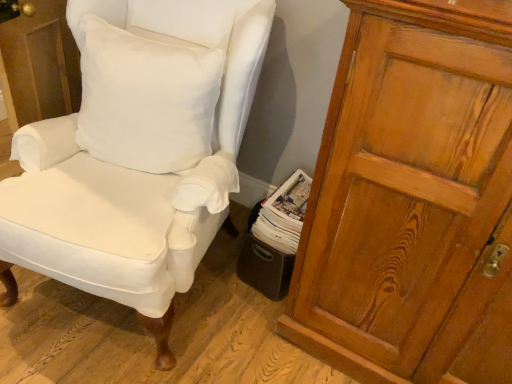
What is the approximate height of white fabric chair at center?

It is 1.01 meters.

Measure the distance between point (x=143, y=56) and camera.

They are 1.31 meters apart.

Image resolution: width=512 pixels, height=384 pixels. Describe the element at coordinates (146, 98) in the screenshot. I see `white cotton pillow at upper left` at that location.

Where is `white fabric chair at center`? Image resolution: width=512 pixels, height=384 pixels. white fabric chair at center is located at coordinates (137, 153).

Is white fabric chair at center facing towards wooden cupboard at right?

No.

Is white fabric chair at center to the left of wooden cupboard at right from the viewer's perspective?

Correct, you'll find white fabric chair at center to the left of wooden cupboard at right.

Which of these two, white fabric chair at center or wooden cupboard at right, is thinner?

With smaller width is wooden cupboard at right.

From a real-world perspective, is white fabric chair at center over wooden cupboard at right?

No, from a real-world perspective, white fabric chair at center is not above wooden cupboard at right.

Is white cotton pillow at upper left in contact with white fabric chair at center?

white cotton pillow at upper left and white fabric chair at center are not in contact.

Could you tell me if white cotton pillow at upper left is facing white fabric chair at center?

Yes, white cotton pillow at upper left faces towards white fabric chair at center.

From a real-world perspective, who is located higher, white cotton pillow at upper left or white fabric chair at center?

In real-world perspective, white cotton pillow at upper left is above.

From the image's perspective, does white cotton pillow at upper left appear higher than white fabric chair at center?

Correct, white cotton pillow at upper left appears higher than white fabric chair at center in the image.

In terms of width, does wooden cupboard at right look wider or thinner when compared to white fabric chair at center?

Clearly, wooden cupboard at right has less width compared to white fabric chair at center.

Is wooden cupboard at right inside the boundaries of white fabric chair at center, or outside?

wooden cupboard at right is not enclosed by white fabric chair at center.

Between wooden cupboard at right and white fabric chair at center, which one has larger size?

white fabric chair at center.

Considering the sizes of objects wooden cupboard at right and white paper magazine at lower center in the image provided, who is wider, wooden cupboard at right or white paper magazine at lower center?

Wider between the two is wooden cupboard at right.

Looking at the image, does wooden cupboard at right seem bigger or smaller compared to white paper magazine at lower center?

In the image, wooden cupboard at right appears to be larger than white paper magazine at lower center.

From the image's perspective, between wooden cupboard at right and white paper magazine at lower center, which one is located above?

wooden cupboard at right, from the image's perspective.

From a real-world perspective, who is located higher, wooden cupboard at right or white paper magazine at lower center?

wooden cupboard at right is physically above.

From the image's perspective, which one is positioned lower, white fabric chair at center or white cotton pillow at upper left?

white fabric chair at center is shown below in the image.

From a real-world perspective, is white fabric chair at center physically above white cotton pillow at upper left?

No, from a real-world perspective, white fabric chair at center is not over white cotton pillow at upper left

Based on the photo, which of these two, white fabric chair at center or white cotton pillow at upper left, is bigger?

Bigger between the two is white fabric chair at center.

Can you confirm if white paper magazine at lower center is wider than white cotton pillow at upper left?

Indeed, white paper magazine at lower center has a greater width compared to white cotton pillow at upper left.

From the image's perspective, does white paper magazine at lower center appear higher than white cotton pillow at upper left?

No, from the image's perspective, white paper magazine at lower center is not above white cotton pillow at upper left.

Is white paper magazine at lower center facing away from white cotton pillow at upper left?

No, white paper magazine at lower center is not facing the opposite direction of white cotton pillow at upper left.

Is white paper magazine at lower center to the left of white cotton pillow at upper left from the viewer's perspective?

No, white paper magazine at lower center is not to the left of white cotton pillow at upper left.

Does white paper magazine at lower center lie behind white fabric chair at center?

Yes, white paper magazine at lower center is behind white fabric chair at center.

Is white paper magazine at lower center facing towards white fabric chair at center?

No, white paper magazine at lower center is not aimed at white fabric chair at center.

Is point (269, 210) closer or farther from the camera than point (155, 179)?

Point (269, 210).

Where is `cupboard that appears below the white fabric chair at center (from the image's perspective)`? This screenshot has width=512, height=384. cupboard that appears below the white fabric chair at center (from the image's perspective) is located at coordinates (408, 190).

Identify the location of chair below the white cotton pillow at upper left (from a real-world perspective). This screenshot has width=512, height=384. (137, 153).

Based on their spatial positions, is white fabric chair at center or white paper magazine at lower center further from white cotton pillow at upper left?

The object further to white cotton pillow at upper left is white paper magazine at lower center.

Which object lies further to the anchor point white cotton pillow at upper left, white paper magazine at lower center or white fabric chair at center?

Based on the image, white paper magazine at lower center appears to be further to white cotton pillow at upper left.

When comparing their distances from wooden cupboard at right, does white paper magazine at lower center or white fabric chair at center seem closer?

Among the two, white paper magazine at lower center is located nearer to wooden cupboard at right.

Estimate the real-world distances between objects in this image. Which object is further from white cotton pillow at upper left, wooden cupboard at right or white fabric chair at center?

wooden cupboard at right is positioned further to the anchor white cotton pillow at upper left.

From the picture: Based on their spatial positions, is white cotton pillow at upper left or white fabric chair at center closer to white paper magazine at lower center?

white fabric chair at center is positioned closer to the anchor white paper magazine at lower center.

Looking at the image, which one is located closer to wooden cupboard at right, white paper magazine at lower center or white cotton pillow at upper left?

white paper magazine at lower center.

From the image, which object appears to be farther from white paper magazine at lower center, white fabric chair at center or wooden cupboard at right?

The object further to white paper magazine at lower center is white fabric chair at center.

Which object lies nearer to the anchor point white fabric chair at center, white paper magazine at lower center or white cotton pillow at upper left?

white cotton pillow at upper left is positioned closer to the anchor white fabric chair at center.

The image size is (512, 384). I want to click on pillow located between white fabric chair at center and white paper magazine at lower center in the depth direction, so click(146, 98).

Find the location of a particular element. magazine situated between white fabric chair at center and wooden cupboard at right from left to right is located at coordinates (284, 213).

This screenshot has height=384, width=512. I want to click on magazine between white cotton pillow at upper left and wooden cupboard at right in the horizontal direction, so click(x=284, y=213).

Identify the location of pillow situated between white fabric chair at center and wooden cupboard at right from left to right. (146, 98).